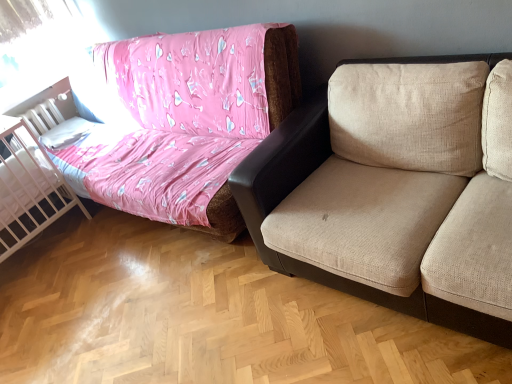
Question: Is beige fabric studio couch at upper right shorter than white mesh crib at left?

Choices:
 (A) yes
 (B) no

Answer: (B)

Question: Can you confirm if beige fabric studio couch at upper right is wider than white mesh crib at left?

Choices:
 (A) no
 (B) yes

Answer: (B)

Question: Is beige fabric studio couch at upper right at the left side of white mesh crib at left?

Choices:
 (A) yes
 (B) no

Answer: (B)

Question: Is beige fabric studio couch at upper right positioned far away from white mesh crib at left?

Choices:
 (A) no
 (B) yes

Answer: (B)

Question: Can you confirm if beige fabric studio couch at upper right is positioned to the right of white mesh crib at left?

Choices:
 (A) yes
 (B) no

Answer: (A)

Question: Is beige fabric studio couch at upper right oriented away from white mesh crib at left?

Choices:
 (A) yes
 (B) no

Answer: (B)

Question: Would you consider white mesh crib at left to be distant from beige fabric studio couch at upper right?

Choices:
 (A) yes
 (B) no

Answer: (A)

Question: Can you confirm if white mesh crib at left is positioned to the left of beige fabric studio couch at upper right?

Choices:
 (A) no
 (B) yes

Answer: (B)

Question: Does white mesh crib at left touch beige fabric studio couch at upper right?

Choices:
 (A) no
 (B) yes

Answer: (A)

Question: Does white mesh crib at left have a lesser width compared to beige fabric studio couch at upper right?

Choices:
 (A) no
 (B) yes

Answer: (B)

Question: Considering the relative sizes of white mesh crib at left and beige fabric studio couch at upper right in the image provided, is white mesh crib at left shorter than beige fabric studio couch at upper right?

Choices:
 (A) no
 (B) yes

Answer: (B)

Question: From the image's perspective, would you say white mesh crib at left is positioned over beige fabric studio couch at upper right?

Choices:
 (A) yes
 (B) no

Answer: (B)

Question: Relative to beige fabric studio couch at upper right, is white mesh crib at left in front or behind?

Choices:
 (A) behind
 (B) front

Answer: (A)